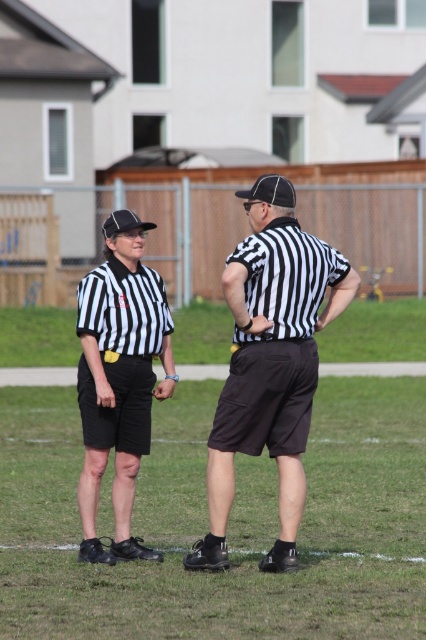
You are a field assistant who needs to hand over a document to both referees. The document must be placed between them so that both can easily reach it. Given that the distance between the black striped shirt at right and matte black referee shirt at left is 74.07 centimeters, what is the minimum width the document should have to ensure both can reach it simultaneously?

The minimum width should be at least 74.07 centimeters so that both the black striped shirt at right and matte black referee shirt at left can reach it simultaneously.

In the scene shown: You are standing at the point closest to the camera. Which of the two points, point (x=296, y=280) or point (x=129, y=548), are you at?

You are at point (x=296, y=280) because it is in front of point (x=129, y=548).

You are a spectator at a soccer match and you need to quickly identify which referee is closer to you based on their clothing. The two referees are wearing the black striped shirt at right and the matte black referee shirt at left. Which one is larger in size?

The black striped shirt at right is larger in size than the matte black referee shirt at left, so the referee wearing the black striped shirt at right is closer to you.